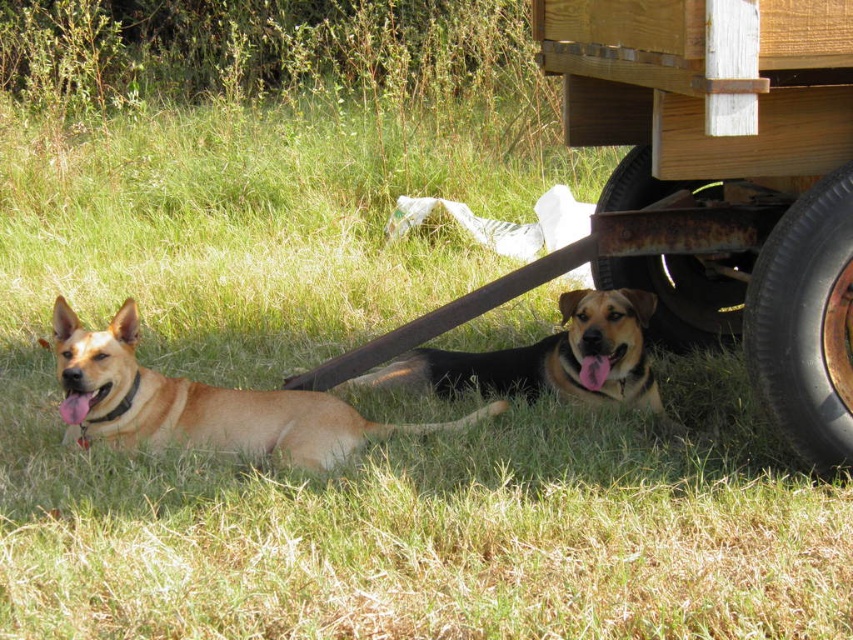
Question: Does golden fur dog at left appear on the left side of rusty metal tire at lower right?

Choices:
 (A) yes
 (B) no

Answer: (A)

Question: Which object is the closest to the black rubber tire at lower right?

Choices:
 (A) brown fur dog at lower center
 (B) rusty metal tire at lower right
 (C) golden fur dog at left

Answer: (A)

Question: Can you confirm if brown fur dog at lower center is bigger than rusty metal tire at lower right?

Choices:
 (A) yes
 (B) no

Answer: (A)

Question: Which of the following is the farthest from the observer?

Choices:
 (A) rusty metal tire at lower right
 (B) golden fur dog at left
 (C) brown fur dog at lower center

Answer: (A)

Question: Does black rubber tire at lower right appear under brown fur dog at lower center?

Choices:
 (A) yes
 (B) no

Answer: (B)

Question: Which point is closer to the camera?

Choices:
 (A) [509, 374]
 (B) [688, 273]
 (C) [428, 428]

Answer: (C)